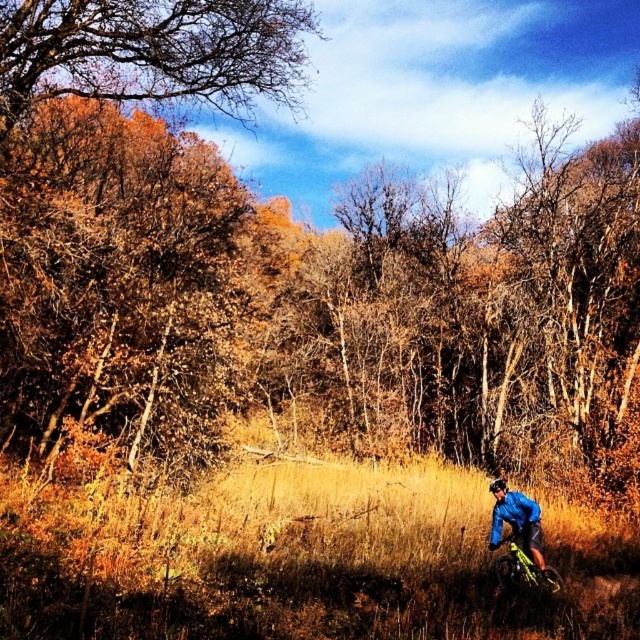
Question: From the image, what is the correct spatial relationship of matte blue jacket at lower right in relation to yellow metallic bicycle at lower right?

Choices:
 (A) left
 (B) right

Answer: (A)

Question: Is matte blue jacket at lower right positioned before yellow metallic bicycle at lower right?

Choices:
 (A) no
 (B) yes

Answer: (A)

Question: Among these points, which one is nearest to the camera?

Choices:
 (A) (513, 573)
 (B) (520, 500)

Answer: (A)

Question: Is matte blue jacket at lower right below yellow metallic bicycle at lower right?

Choices:
 (A) no
 (B) yes

Answer: (A)

Question: Among these objects, which one is farthest from the camera?

Choices:
 (A) yellow metallic bicycle at lower right
 (B) matte blue jacket at lower right

Answer: (B)